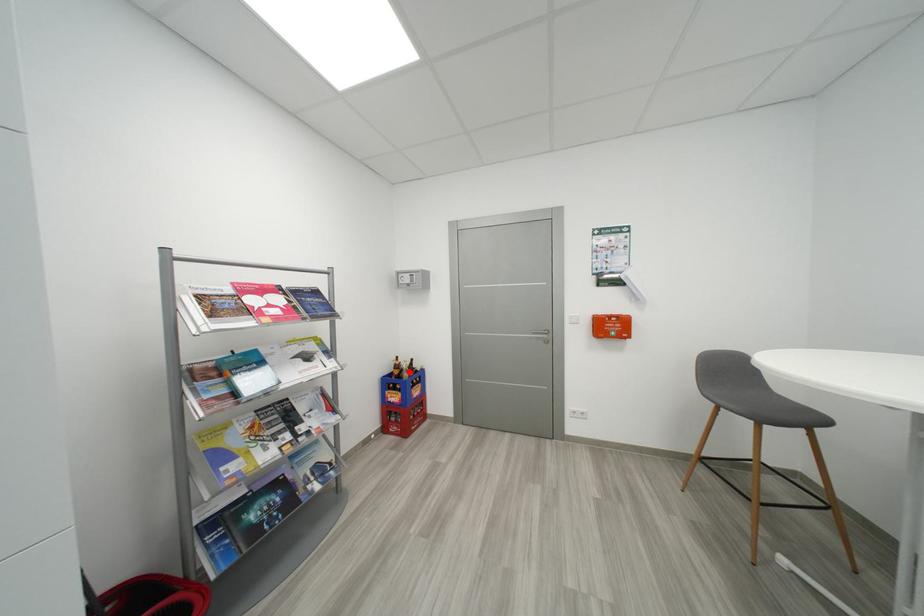
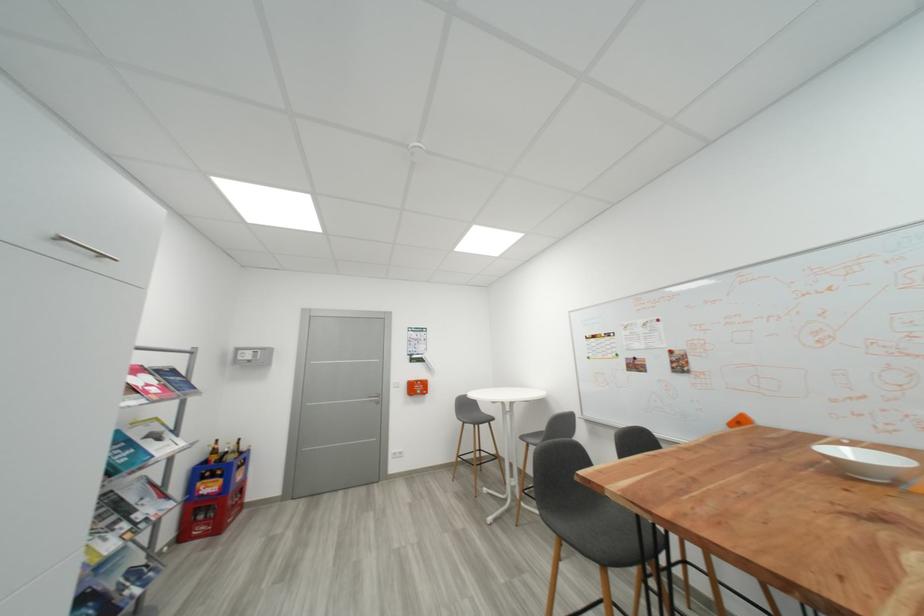
In the second image, find the point that corresponds to the highlighted location in the first image.

(234, 454)